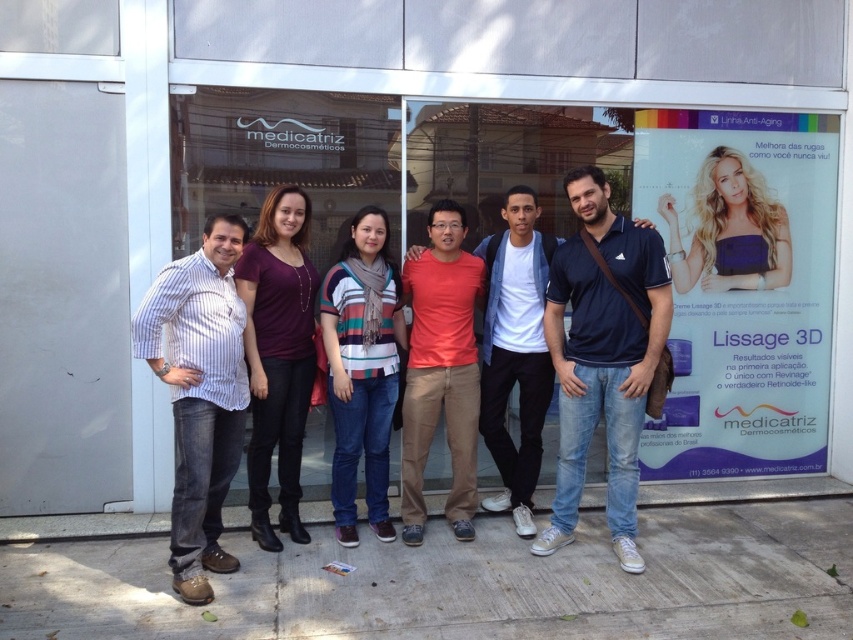
Who is lower down, striped cotton shirt at left or matte purple shirt at center?

Positioned lower is striped cotton shirt at left.

Does striped cotton shirt at left appear on the right side of matte purple shirt at center?

Incorrect, striped cotton shirt at left is not on the right side of matte purple shirt at center.

Between point (219, 349) and point (259, 304), which one is positioned in front?

Positioned in front is point (219, 349).

You are a GUI agent. You are given a task and a screenshot of the screen. Output one action in this format:
    pyautogui.click(x=<x>, y=<y>)
    Task: Click on the striped cotton shirt at left
    This screenshot has height=640, width=853.
    Given the screenshot: What is the action you would take?
    pyautogui.click(x=199, y=394)

Is red matte shirt at center below striped sweater at center?

Actually, red matte shirt at center is above striped sweater at center.

This screenshot has width=853, height=640. Identify the location of red matte shirt at center. (440, 369).

Image resolution: width=853 pixels, height=640 pixels. Describe the element at coordinates (440, 369) in the screenshot. I see `red matte shirt at center` at that location.

You are a GUI agent. You are given a task and a screenshot of the screen. Output one action in this format:
    pyautogui.click(x=<x>, y=<y>)
    Task: Click on the red matte shirt at center
    Image resolution: width=853 pixels, height=640 pixels.
    Given the screenshot: What is the action you would take?
    pyautogui.click(x=440, y=369)

Between point (292, 512) and point (701, 248), which one is positioned behind?

Point (701, 248)

The height and width of the screenshot is (640, 853). Find the location of `matte purple shirt at center`. matte purple shirt at center is located at coordinates (277, 355).